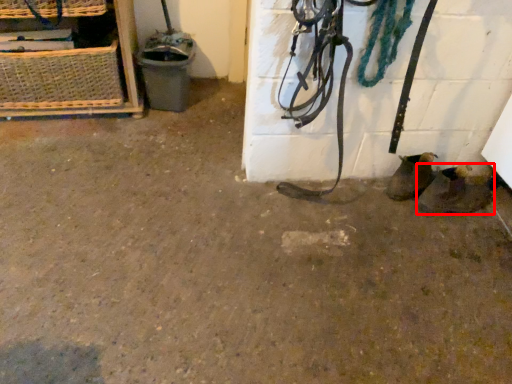
Question: From the image, what is the correct spatial relationship of footwear (annotated by the red box) in relation to basket?

Choices:
 (A) right
 (B) left

Answer: (A)